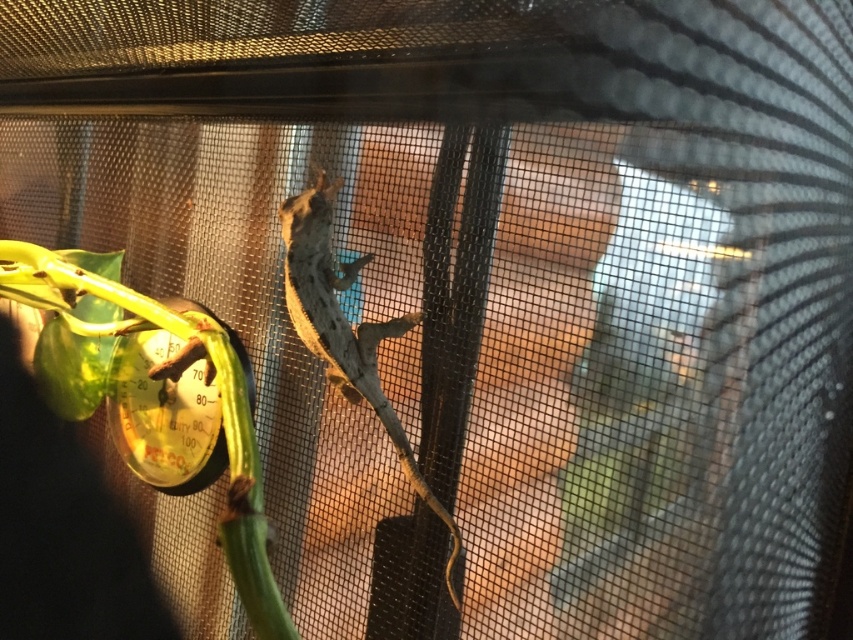
Is green leafy plant at left in front of smooth gray lizard at center?

Yes, green leafy plant at left is in front of smooth gray lizard at center.

Who is lower down, green leafy plant at left or smooth gray lizard at center?

Positioned lower is smooth gray lizard at center.

This screenshot has height=640, width=853. I want to click on green leafy plant at left, so click(x=221, y=412).